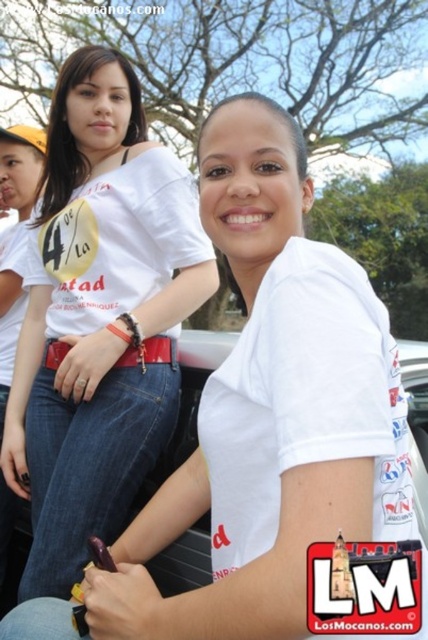
What is located at the coordinates point (100, 317) in the image?

The white matte t shirt at center is located at point (100, 317).